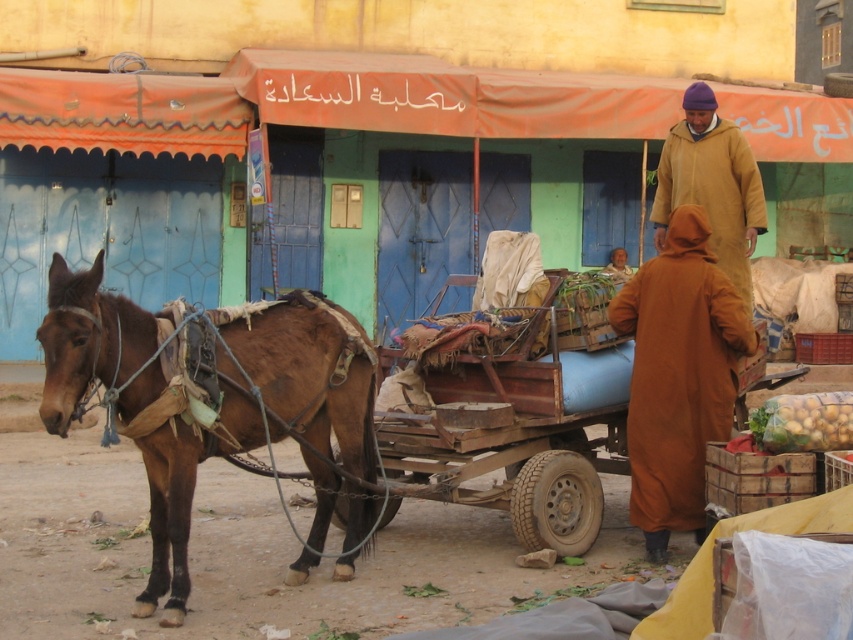
Question: Which point is farther to the camera?

Choices:
 (A) brown leather mule at left
 (B) beige woolen robe at upper right
 (C) brown woolen robe at center
 (D) wooden cart at center

Answer: (D)

Question: Is brown leather mule at left to the right of wooden cart at center from the viewer's perspective?

Choices:
 (A) no
 (B) yes

Answer: (A)

Question: Which object is the farthest from the brown woolen robe at center?

Choices:
 (A) wooden cart at center
 (B) brown leather mule at left
 (C) beige woolen robe at upper right

Answer: (B)

Question: Can you confirm if wooden cart at center is positioned to the right of brown woolen robe at center?

Choices:
 (A) no
 (B) yes

Answer: (A)

Question: Considering the relative positions of brown leather mule at left and beige woolen robe at upper right in the image provided, where is brown leather mule at left located with respect to beige woolen robe at upper right?

Choices:
 (A) above
 (B) below

Answer: (B)

Question: Which object is positioned closest to the brown leather mule at left?

Choices:
 (A) wooden cart at center
 (B) beige woolen robe at upper right
 (C) brown woolen robe at center

Answer: (A)